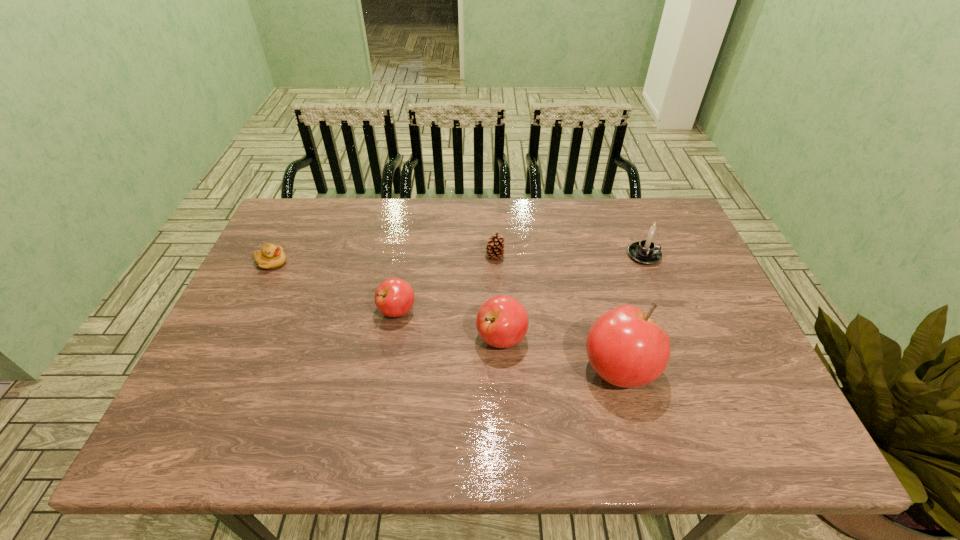
At what (x,y) coordinates should I click in order to perform the action: click on the leftmost apple. Please return your answer as a coordinate pair (x, y). The width and height of the screenshot is (960, 540). Looking at the image, I should click on (394, 297).

This screenshot has height=540, width=960. What are the coordinates of `the fifth object from right to left` in the screenshot? It's located at (394, 297).

Identify the location of the second shortest apple. (502, 321).

The height and width of the screenshot is (540, 960). I want to click on the rightmost apple, so click(x=625, y=347).

Where is `the tallest object`? The image size is (960, 540). the tallest object is located at coordinates (625, 347).

Identify the location of the leftmost object. This screenshot has width=960, height=540. (271, 256).

Where is `duckling`? The height and width of the screenshot is (540, 960). duckling is located at coordinates (271, 256).

I want to click on the rightmost object, so click(x=646, y=252).

What are the coordinates of `pinecone` in the screenshot? It's located at (494, 248).

The width and height of the screenshot is (960, 540). I want to click on free region located 0.110m on the left of the leftmost apple, so coord(336,311).